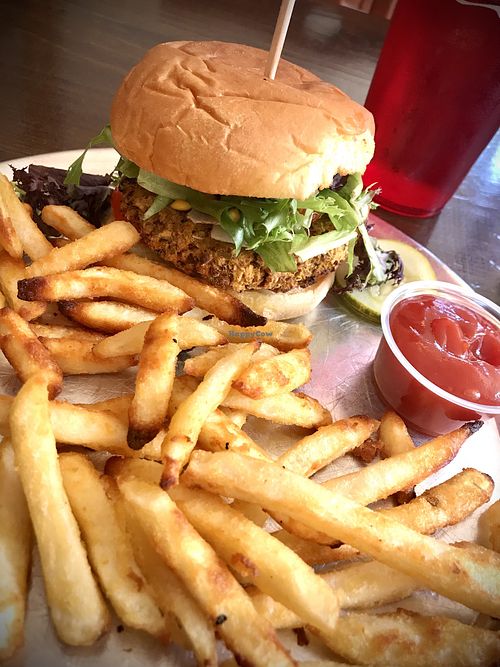
Where is `dark brown hardwood table surface`? dark brown hardwood table surface is located at coordinates (85, 55).